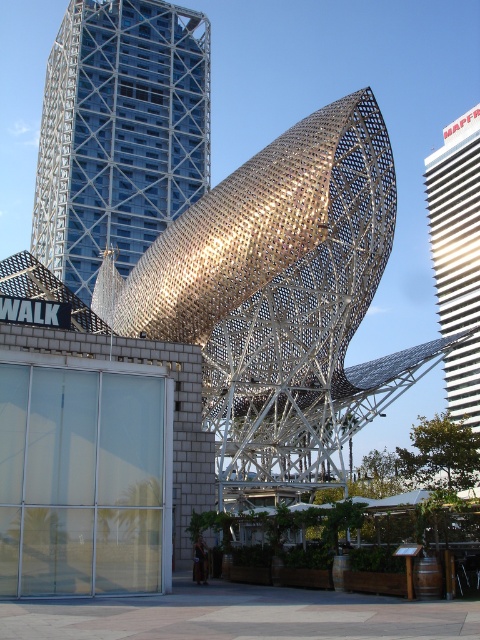
Question: Which point is closer to the camera?

Choices:
 (A) white glossy tower at right
 (B) blue glassy tower at upper left

Answer: (A)

Question: Where is blue glassy tower at upper left located in relation to white glossy tower at right in the image?

Choices:
 (A) right
 (B) left

Answer: (B)

Question: Is blue glassy tower at upper left bigger than white glossy tower at right?

Choices:
 (A) no
 (B) yes

Answer: (A)

Question: Among these objects, which one is nearest to the camera?

Choices:
 (A) white glossy tower at right
 (B) blue glassy tower at upper left

Answer: (A)

Question: Among these points, which one is nearest to the camera?

Choices:
 (A) (69, 145)
 (B) (479, 282)

Answer: (A)

Question: Where is blue glassy tower at upper left located in relation to white glossy tower at right in the image?

Choices:
 (A) left
 (B) right

Answer: (A)